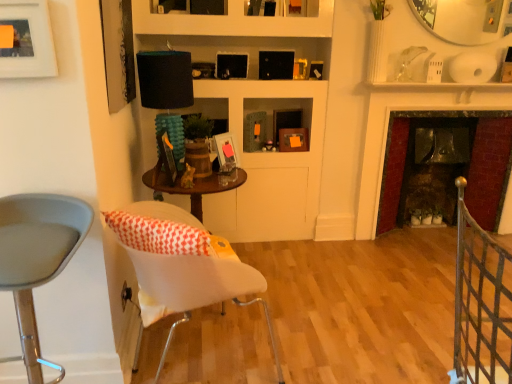
Question: Is black fabric lampshade at upper center to the left of matte black picture frame at upper center, marked as the 5th picture frame in a left-to-right arrangement, from the viewer's perspective?

Choices:
 (A) yes
 (B) no

Answer: (A)

Question: Is black fabric lampshade at upper center completely or partially outside of matte black picture frame at upper center, marked as the 5th picture frame in a left-to-right arrangement?

Choices:
 (A) no
 (B) yes

Answer: (B)

Question: Does black fabric lampshade at upper center lie behind matte black picture frame at upper center, the first picture frame viewed from the back?

Choices:
 (A) no
 (B) yes

Answer: (A)

Question: Considering the relative sizes of black fabric lampshade at upper center and matte black picture frame at upper center, marked as the 5th picture frame in a left-to-right arrangement, in the image provided, is black fabric lampshade at upper center wider than matte black picture frame at upper center, marked as the 5th picture frame in a left-to-right arrangement,?

Choices:
 (A) no
 (B) yes

Answer: (B)

Question: Is black fabric lampshade at upper center to the right of matte black picture frame at upper center, the first picture frame viewed from the back, from the viewer's perspective?

Choices:
 (A) no
 (B) yes

Answer: (A)

Question: Is there a large distance between black fabric lampshade at upper center and matte black picture frame at upper center, which ranks as the first picture frame in right-to-left order?

Choices:
 (A) yes
 (B) no

Answer: (A)

Question: Would you say matte black picture frame at upper left, which ranks as the 2th picture frame in left-to-right order, is outside dark red brick fireplace at right?

Choices:
 (A) yes
 (B) no

Answer: (A)

Question: Is matte black picture frame at upper left, which is the fourth picture frame in back-to-front order, turned away from dark red brick fireplace at right?

Choices:
 (A) yes
 (B) no

Answer: (B)

Question: Considering the relative sizes of matte black picture frame at upper left, which is the fourth picture frame in back-to-front order, and dark red brick fireplace at right in the image provided, is matte black picture frame at upper left, which is the fourth picture frame in back-to-front order, shorter than dark red brick fireplace at right?

Choices:
 (A) no
 (B) yes

Answer: (B)

Question: Can you confirm if matte black picture frame at upper left, which is the fourth picture frame in back-to-front order, is wider than dark red brick fireplace at right?

Choices:
 (A) yes
 (B) no

Answer: (B)

Question: Is matte black picture frame at upper left, the fourth picture frame when ordered from right to left, at the left side of dark red brick fireplace at right?

Choices:
 (A) no
 (B) yes

Answer: (B)

Question: Could dark red brick fireplace at right be considered to be inside matte black picture frame at upper left, the fourth picture frame when ordered from right to left?

Choices:
 (A) no
 (B) yes

Answer: (A)

Question: Is matte black picture frame at upper center, marked as the 5th picture frame in a left-to-right arrangement, behind matte wooden picture frame at center, the 4th picture frame viewed from the left?

Choices:
 (A) yes
 (B) no

Answer: (A)